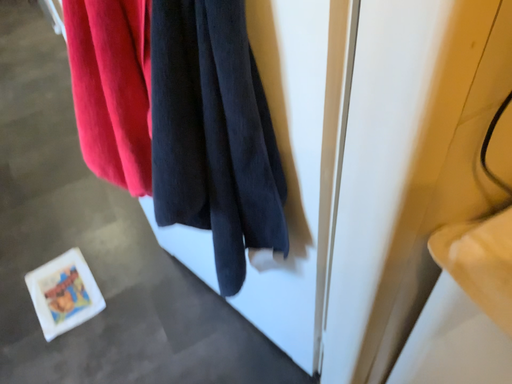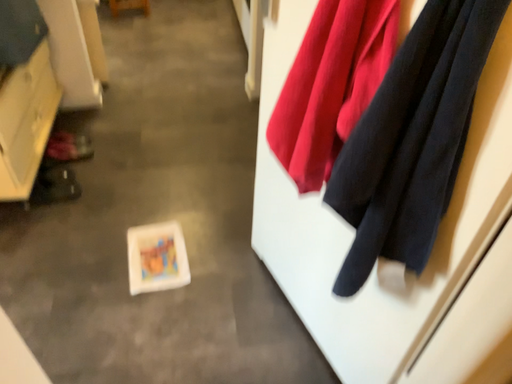
Question: Which way did the camera rotate in the video?

Choices:
 (A) rotated left
 (B) rotated right

Answer: (A)